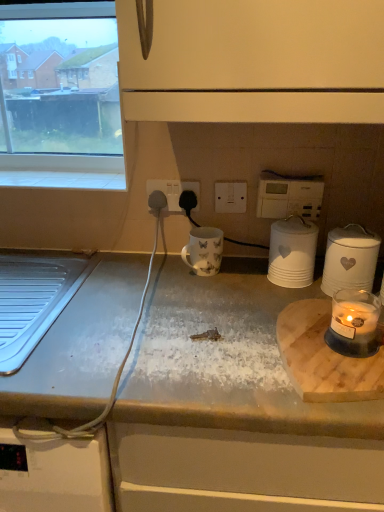
Find the location of a particular element. The image size is (384, 512). free space in front of white matte canister at center-right, placed as the second kitchen appliance when sorted from right to left is located at coordinates (x=274, y=304).